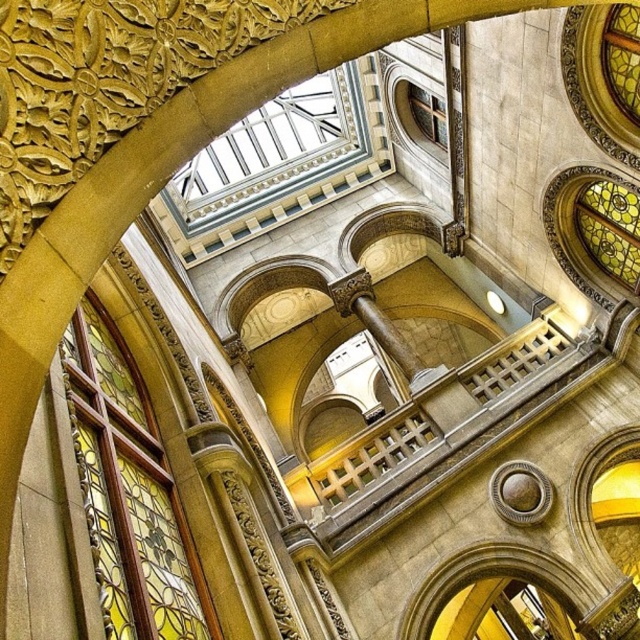
You are an architect analyzing the building structure. You need to determine which object, the stained glass window at left or the transparent glass ceiling at upper center, allows more natural light into the space. Based on their heights, which one would you expect to let in more light?

The transparent glass ceiling at upper center allows more natural light into the space because it has a greater height than the stained glass window at left.

You are an art conservator inspecting the stained glass windows in the grand hall. You need to document the positions of the stained glass window at left and the stained glass window at upper right. Which of these two stained glass windows is positioned further to the left side of the room?

The stained glass window at left is positioned further to the left side of the room compared to the stained glass window at upper right.

You are standing in the grand historical building and want to know if the point at coordinates point (208, 179) is closer to you or the point at coordinates point (417, 125). Which point is closer to you?

Point (417, 125) is closer to you because it is in front of point (208, 179).